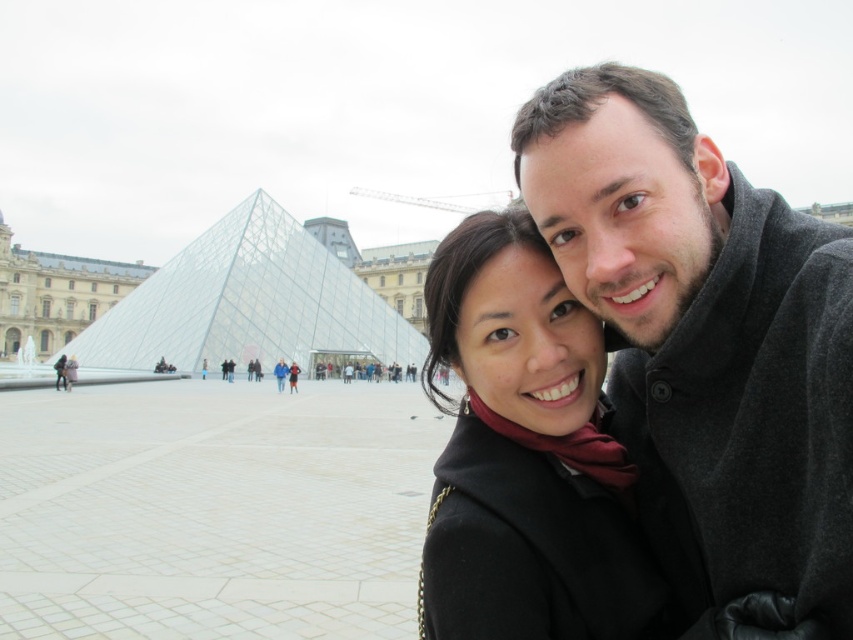
Measure the distance between black matte coat at center and transparent glass pyramid at center.

black matte coat at center and transparent glass pyramid at center are 58.61 meters apart.

Is the position of black matte coat at center more distant than that of transparent glass pyramid at center?

That is False.

Where is `black matte coat at center`? The image size is (853, 640). black matte coat at center is located at coordinates (527, 456).

Find the location of a particular element. black matte coat at center is located at coordinates (527, 456).

Who is higher up, dark gray wool coat at upper right or black matte coat at center?

dark gray wool coat at upper right is above.

The width and height of the screenshot is (853, 640). In order to click on dark gray wool coat at upper right in this screenshot , I will do `click(706, 324)`.

Is point (825, 573) positioned before point (532, 301)?

Yes, it is in front of point (532, 301).

The width and height of the screenshot is (853, 640). What are the coordinates of `dark gray wool coat at upper right` in the screenshot? It's located at (706, 324).

Who is shorter, dark gray wool coat at upper right or transparent glass pyramid at center?

With less height is transparent glass pyramid at center.

Find the location of a particular element. dark gray wool coat at upper right is located at coordinates (x=706, y=324).

This screenshot has width=853, height=640. What do you see at coordinates (706, 324) in the screenshot?
I see `dark gray wool coat at upper right` at bounding box center [706, 324].

Find the location of a particular element. This screenshot has height=640, width=853. dark gray wool coat at upper right is located at coordinates (706, 324).